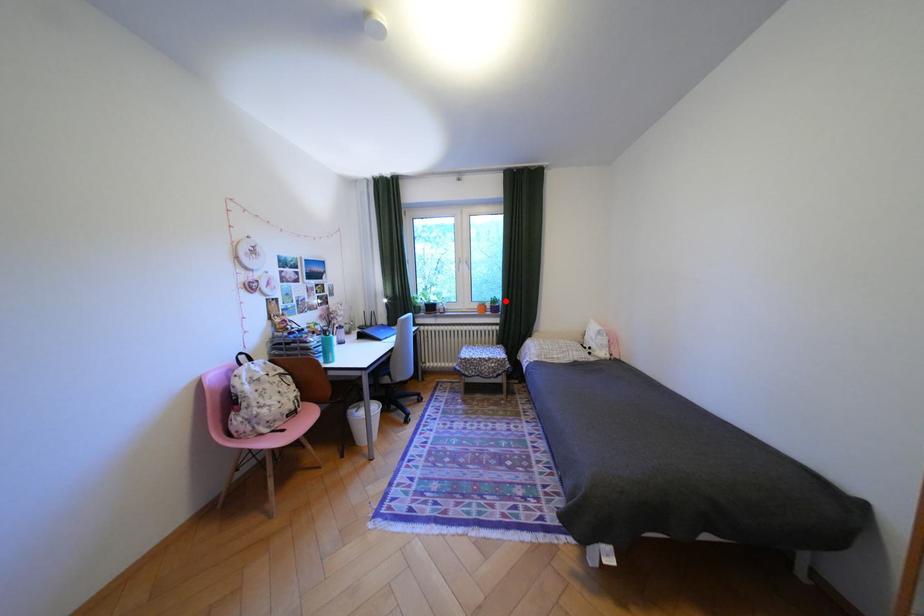
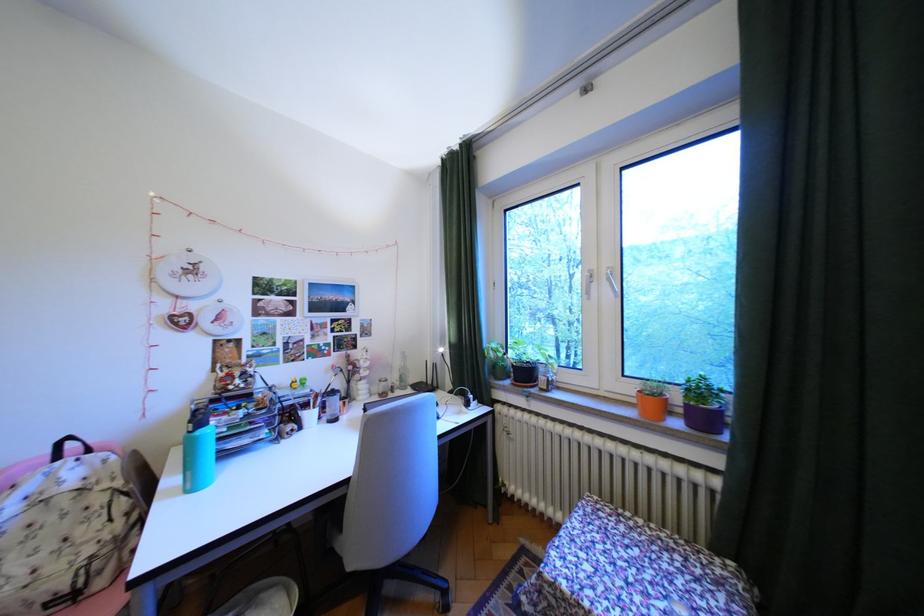
Where in the second image is the point corresponding to the highlighted location from the first image?

(710, 391)